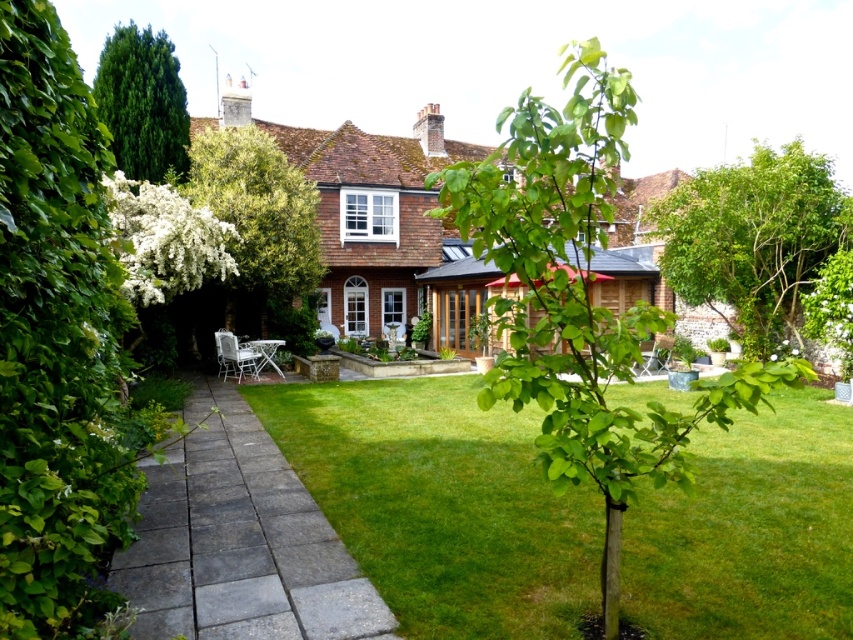
Question: Does green leafy hedge at left appear under green leafy tree at upper left?

Choices:
 (A) no
 (B) yes

Answer: (B)

Question: Is green leafy hedge at left bigger than green leafy tree at upper left?

Choices:
 (A) no
 (B) yes

Answer: (A)

Question: Does wooden terrace at center have a larger size compared to white plastic chair at center?

Choices:
 (A) yes
 (B) no

Answer: (A)

Question: Which object appears farthest from the camera in this image?

Choices:
 (A) gray stone path at center
 (B) green leafy tree at center
 (C) green grass at center
 (D) green leafy tree at upper right

Answer: (D)

Question: Which is nearer to the green leafy tree at upper left?

Choices:
 (A) green grass at center
 (B) gray stone path at center
 (C) green leafy tree at center
 (D) wooden terrace at center

Answer: (D)

Question: Which of the following is the farthest from the observer?

Choices:
 (A) (223, 340)
 (B) (167, 77)
 (C) (613, 280)
 (D) (367, 618)

Answer: (C)